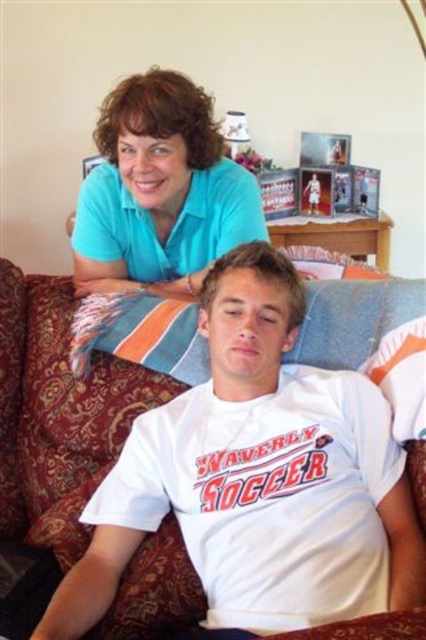
Is point (39, 513) positioned in front of point (212, 252)?

Yes, point (39, 513) is closer to viewer.

Who is more forward, (x=423, y=452) or (x=152, y=177)?

Point (x=423, y=452) is more forward.

At what (x,y) coordinates should I click in order to perform the action: click on velvet-like brown couch at center. Please return your answer as a coordinate pair (x, y). The width and height of the screenshot is (426, 640). Looking at the image, I should click on [57, 413].